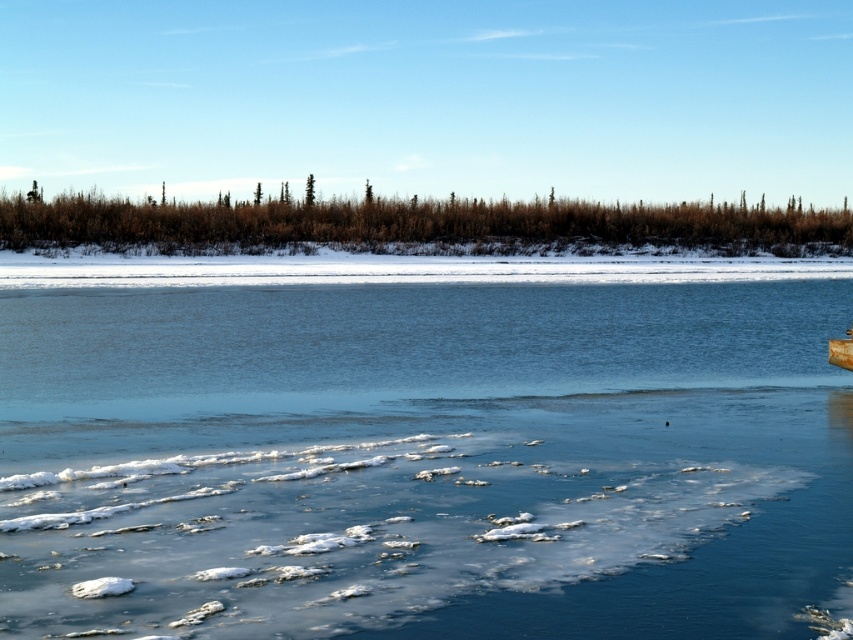
Consider the image. You are planning to place the wooden canoe at lower right onto the translucent ice at center. Based on the scene description, will the ice support the canoe?

The translucent ice at center has a greater height compared to wooden canoe at lower right, which indicates it is thicker and therefore capable of supporting the weight of the wooden canoe at lower right.

You are an ice fisherman planning to drill a hole to fish. You have a drill that can only penetrate 10 cm into the ice. You see the translucent ice at center and the wooden canoe at lower right. Which ice should you choose to drill your hole?

The translucent ice at center is above wooden canoe at lower right, so the ice at center is thicker and safer for drilling since it is above the canoe and likely has sufficient thickness to support the fisherman.